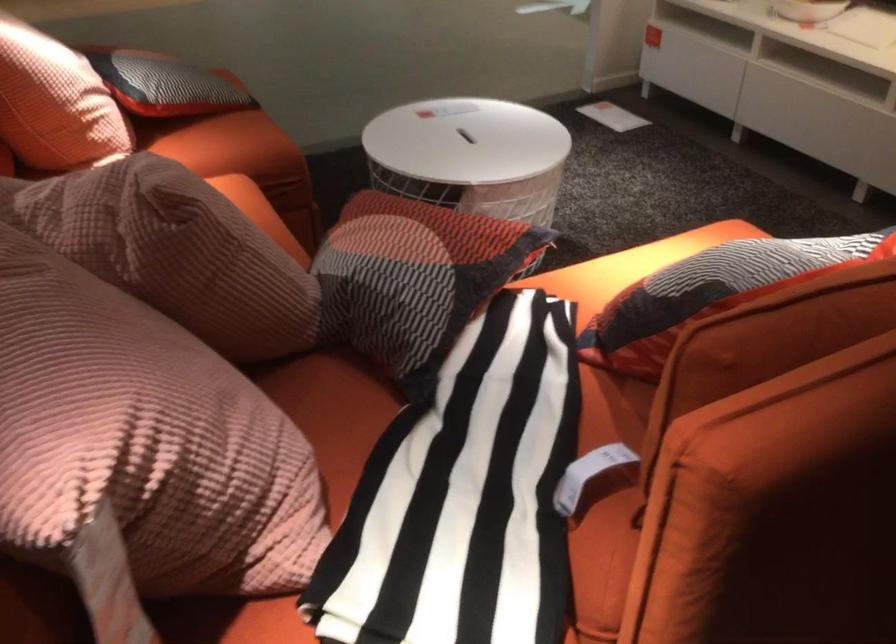
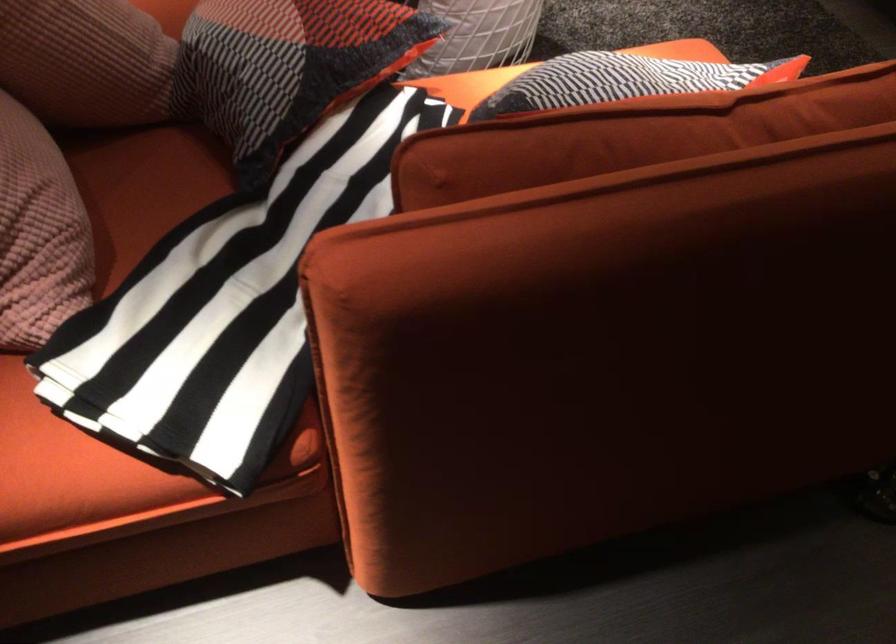
In the second image, find the point that corresponds to pixel 444 285 in the first image.

(288, 67)